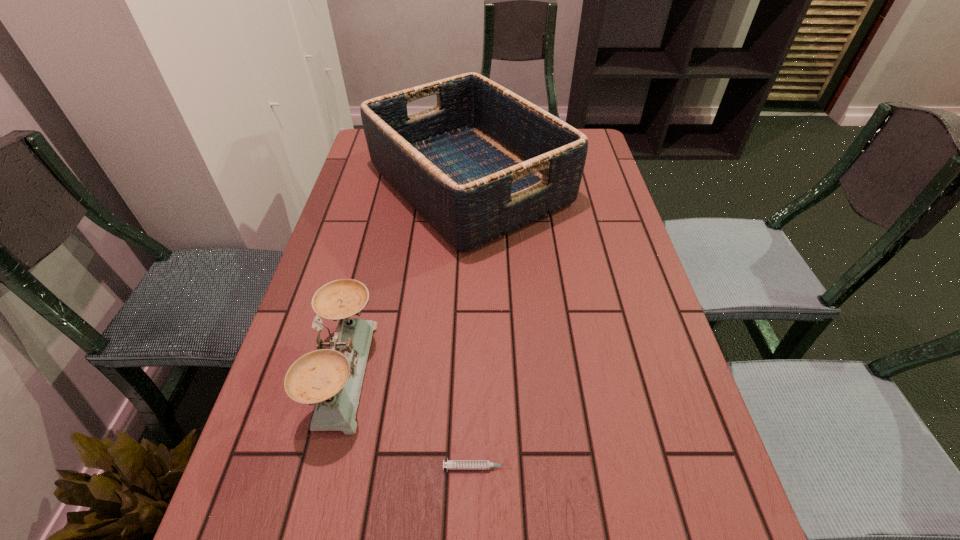
Find the location of a particular element. The width and height of the screenshot is (960, 540). vacant area that lies between the scale and the nearest object is located at coordinates (412, 420).

What are the coordinates of `blank region between the basket and the second nearest object` in the screenshot? It's located at (407, 278).

Where is `object identified as the closest to the syringe`? The image size is (960, 540). object identified as the closest to the syringe is located at coordinates (331, 377).

Identify the location of object identified as the second closest to the tallest object. (450, 464).

The width and height of the screenshot is (960, 540). In order to click on free space that satisfies the following two spatial constraints: 1. on the front side of the basket; 2. on the front-facing side of the scale in this screenshot , I will do `click(464, 372)`.